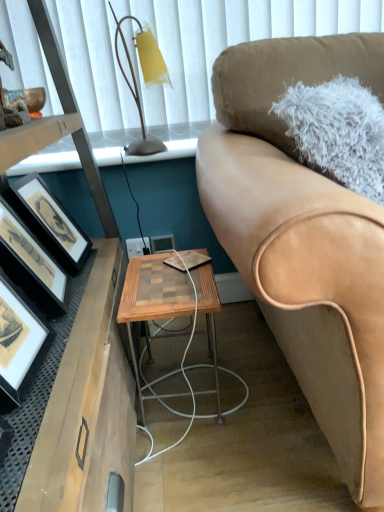
Question: Considering the relative positions of tan leather couch at right and matte black picture frame at left, positioned as the second picture frame in right-to-left order, in the image provided, is tan leather couch at right to the left or to the right of matte black picture frame at left, positioned as the second picture frame in right-to-left order,?

Choices:
 (A) left
 (B) right

Answer: (B)

Question: Considering the positions of point (233, 160) and point (64, 282), is point (233, 160) closer or farther from the camera than point (64, 282)?

Choices:
 (A) farther
 (B) closer

Answer: (B)

Question: Which object is the closest to the wooden picture frame at center, which appears as the 1th picture frame when viewed from the right?

Choices:
 (A) woodenmaterial/texturetable at center
 (B) white fabric window screen at upper center
 (C) matte black picture frame at left, the 2th picture frame from the back
 (D) tan leather couch at right
 (E) matte yellow glass at upper left

Answer: (C)

Question: Which of these objects is positioned farthest from the wooden desk at left?

Choices:
 (A) matte yellow glass at upper left
 (B) matte black picture frame at left, the 2th picture frame from the back
 (C) tan leather couch at right
 (D) white fabric window screen at upper center
 (E) woodenmaterial/texturetable at center

Answer: (A)